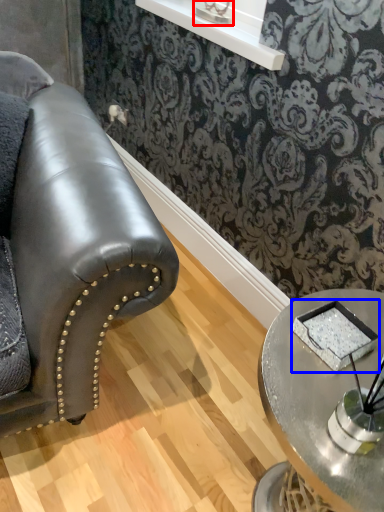
Question: Which of the following is the farthest to the observer, table lamp (highlighted by a red box) or pad (highlighted by a blue box)?

Choices:
 (A) table lamp
 (B) pad

Answer: (A)